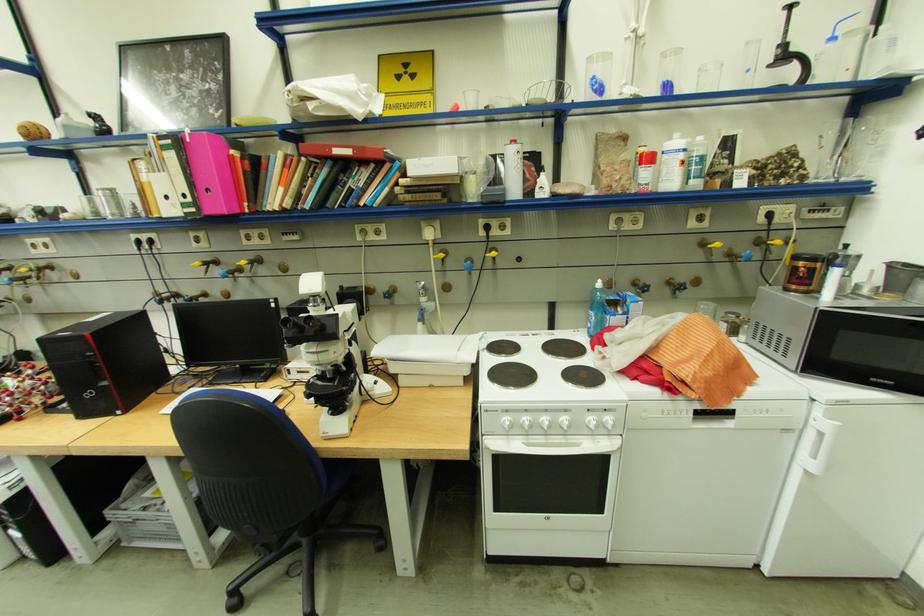
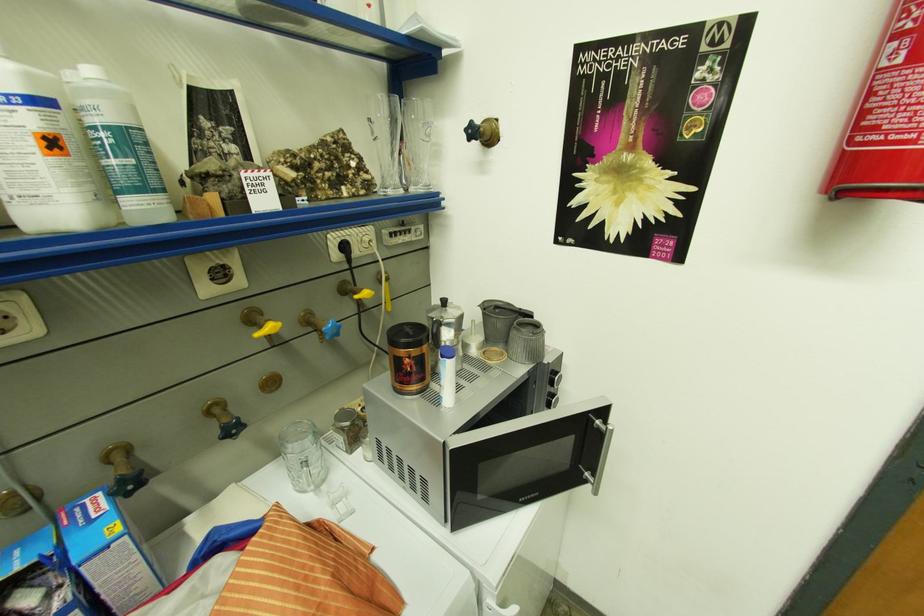
In the second image, find the point that corresponds to point (815, 268) in the first image.

(419, 359)